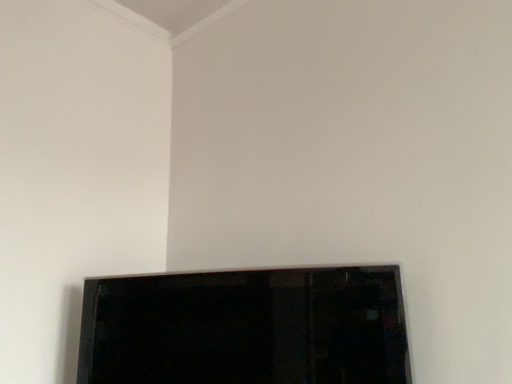
Image resolution: width=512 pixels, height=384 pixels. What do you see at coordinates (246, 328) in the screenshot?
I see `black glossy tv at lower center` at bounding box center [246, 328].

Locate an element on the screen. Image resolution: width=512 pixels, height=384 pixels. black glossy tv at lower center is located at coordinates (246, 328).

Find the location of a particular element. black glossy tv at lower center is located at coordinates (246, 328).